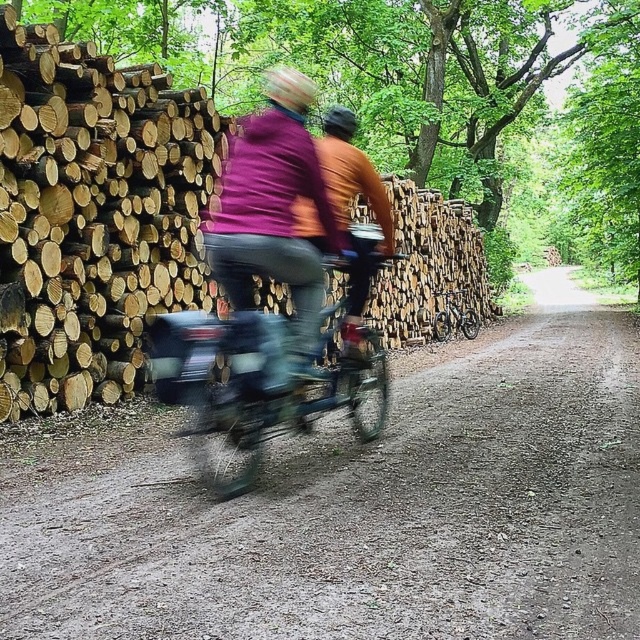
Question: Which point is farther to the camera?

Choices:
 (A) (232, 310)
 (B) (451, 300)
 (C) (28, 396)
 (D) (484, 538)

Answer: (B)

Question: Does matte purple jacket at center lie in front of orange fabric jacket at center?

Choices:
 (A) no
 (B) yes

Answer: (B)

Question: Which object is the farthest from the shiny metallic bicycle at center?

Choices:
 (A) natural wood logs at left
 (B) orange fabric jacket at center
 (C) dirt track at center

Answer: (B)

Question: Is metallic blue bicycle at center positioned in front of matte purple jacket at center?

Choices:
 (A) yes
 (B) no

Answer: (A)

Question: Is dirt track at center to the left of matte purple jacket at center from the viewer's perspective?

Choices:
 (A) no
 (B) yes

Answer: (A)

Question: Which is nearer to the shiny metallic bicycle at center?

Choices:
 (A) dirt track at center
 (B) natural wood logs at left
 (C) metallic blue bicycle at center

Answer: (A)